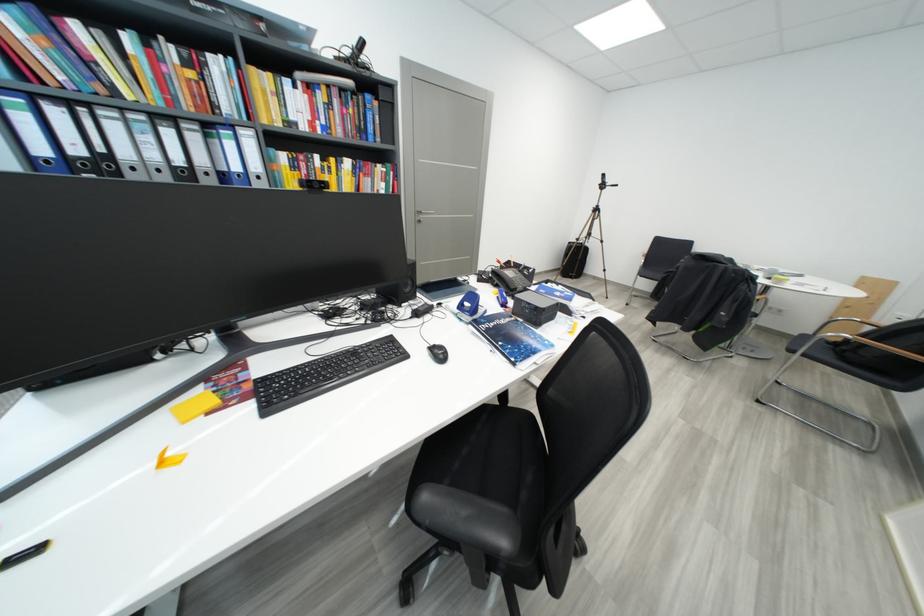
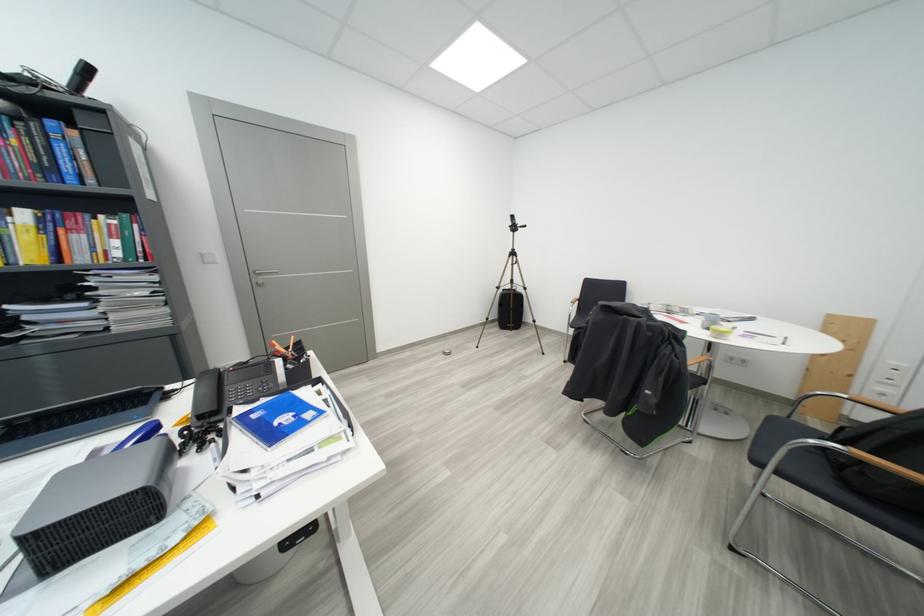
Where in the second image is the point corresponding to (x=853, y=362) from the first image?

(856, 487)